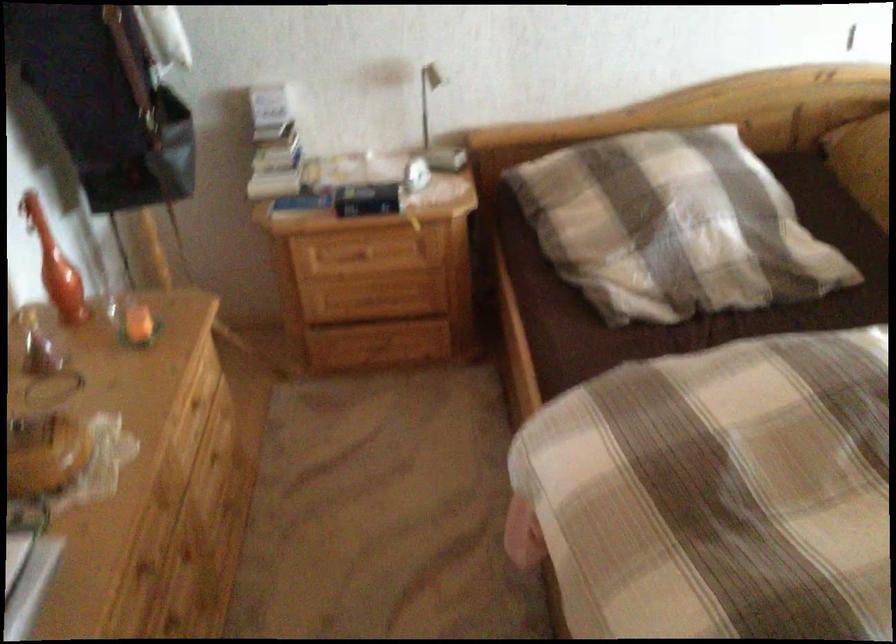
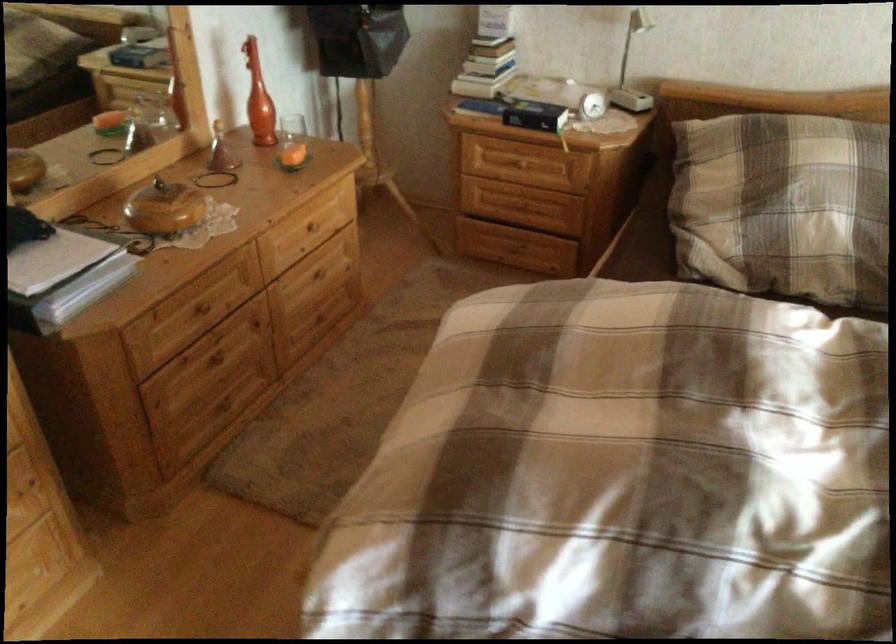
The point at (277,187) is marked in the first image. Where is the corresponding point in the second image?

(474, 86)